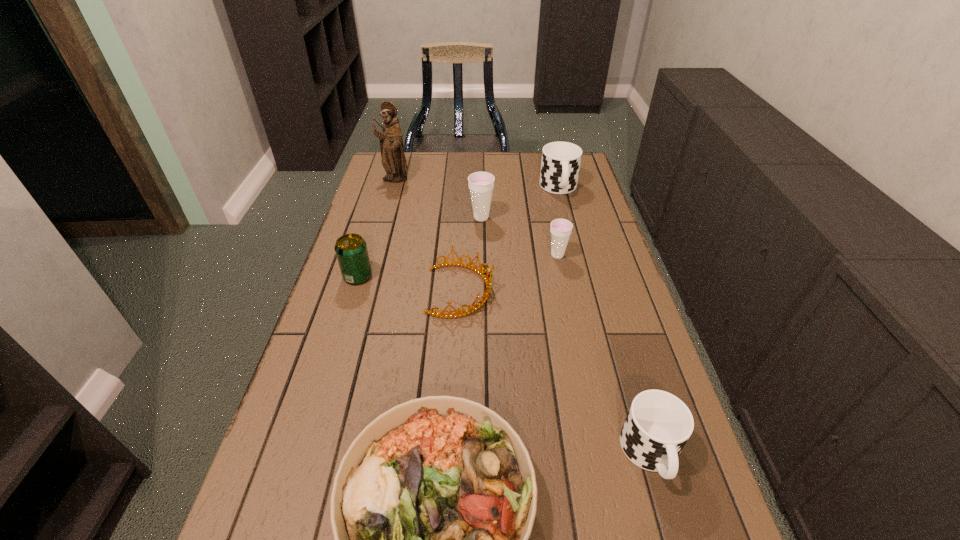
Identify the location of tiara. (488, 278).

Locate an element on the screen. free space located on the front-facing side of the tallest object is located at coordinates (384, 215).

What are the coordinates of `vacant area situated 0.100m on the front of the sixth nearest object` in the screenshot? It's located at (481, 244).

The height and width of the screenshot is (540, 960). I want to click on free region located 0.220m on the side of the farthest cup with the handle, so click(x=572, y=241).

Image resolution: width=960 pixels, height=540 pixels. Find the location of `vacant area situated on the front of the beer can`. vacant area situated on the front of the beer can is located at coordinates (348, 308).

Locate an element on the screen. vacant area situated on the back of the nearer purple cup is located at coordinates (547, 206).

Where is `free space located 0.050m on the side of the smaller black cup with the handle`? free space located 0.050m on the side of the smaller black cup with the handle is located at coordinates (671, 523).

Identify the location of free spot located 0.120m on the front-facing side of the tiara. The height and width of the screenshot is (540, 960). (539, 290).

Where is `figurine positioned at the far edge`? The height and width of the screenshot is (540, 960). figurine positioned at the far edge is located at coordinates (393, 160).

Locate an element on the screen. cup that is positioned at the far edge is located at coordinates (560, 165).